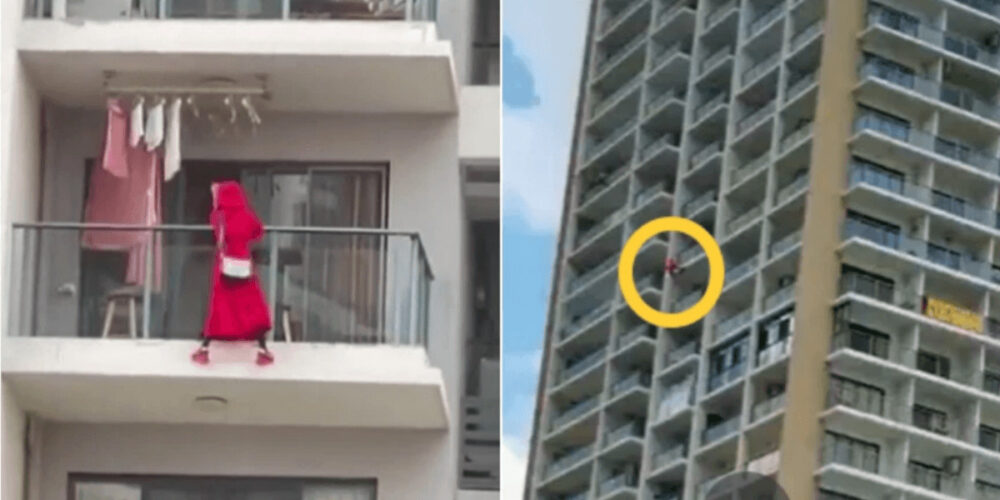
Image resolution: width=1000 pixels, height=500 pixels. What are the coordinates of `stool` in the screenshot? It's located at (124, 304).